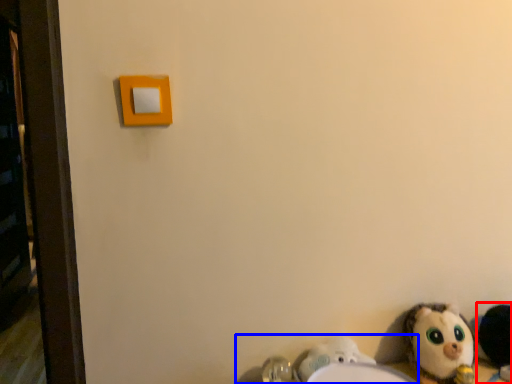
Question: Which of the following is the closest to the observer, toy (highlighted by a red box) or sink (highlighted by a blue box)?

Choices:
 (A) toy
 (B) sink

Answer: (B)